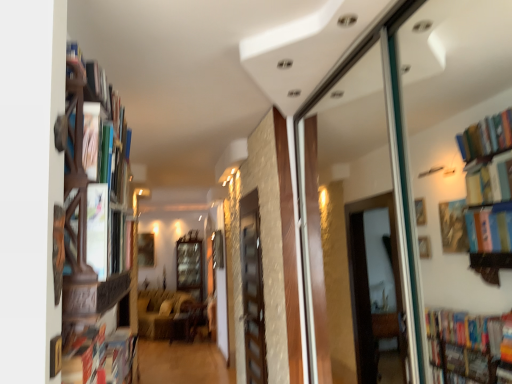
Question: Considering the positions of point (81, 231) and point (252, 296), is point (81, 231) closer or farther from the camera than point (252, 296)?

Choices:
 (A) closer
 (B) farther

Answer: (A)

Question: From the image's perspective, is wooden bookshelf at left positioned above or below wooden screen door at center?

Choices:
 (A) below
 (B) above

Answer: (B)

Question: Estimate the real-world distances between objects in this image. Which object is closer to the wooden cabinet at center?

Choices:
 (A) wooden screen door at center
 (B) wooden bookshelf at left
 (C) velvet beige sofa at center

Answer: (C)

Question: Which object is positioned closest to the wooden screen door at center?

Choices:
 (A) wooden cabinet at center
 (B) wooden bookshelf at left
 (C) velvet beige sofa at center

Answer: (B)